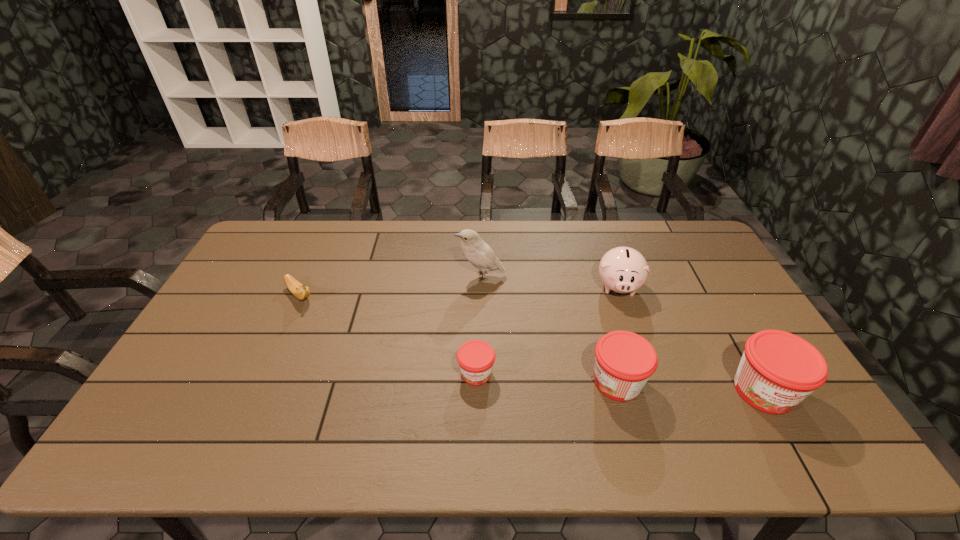
I want to click on blank space located on the right of the leftmost object, so coord(414,295).

Find the location of a particular element. The width and height of the screenshot is (960, 540). vacant space located 0.220m on the left of the piggy bank is located at coordinates (527, 286).

Where is `vacant region located at the beak of the tallest object`? This screenshot has width=960, height=540. vacant region located at the beak of the tallest object is located at coordinates (398, 276).

The height and width of the screenshot is (540, 960). In order to click on vacant space located 0.250m at the beak of the tallest object in this screenshot , I will do `click(380, 276)`.

Where is `free location located 0.120m at the beak of the tallest object`? This screenshot has height=540, width=960. free location located 0.120m at the beak of the tallest object is located at coordinates (420, 276).

The image size is (960, 540). I want to click on object that is at the right edge, so click(778, 370).

In order to click on object that is at the near right corner in this screenshot , I will do (778, 370).

The width and height of the screenshot is (960, 540). In order to click on vacant space at the far edge of the desktop in this screenshot , I will do `click(355, 249)`.

In the image, there is a desktop. Where is `free region at the near edge`? This screenshot has width=960, height=540. free region at the near edge is located at coordinates (461, 403).

You are a GUI agent. You are given a task and a screenshot of the screen. Output one action in this format:
    pyautogui.click(x=<x>, y=<y>)
    Task: Click on the free space at the left edge of the desktop
    Image resolution: width=960 pixels, height=540 pixels.
    Given the screenshot: What is the action you would take?
    pyautogui.click(x=179, y=383)